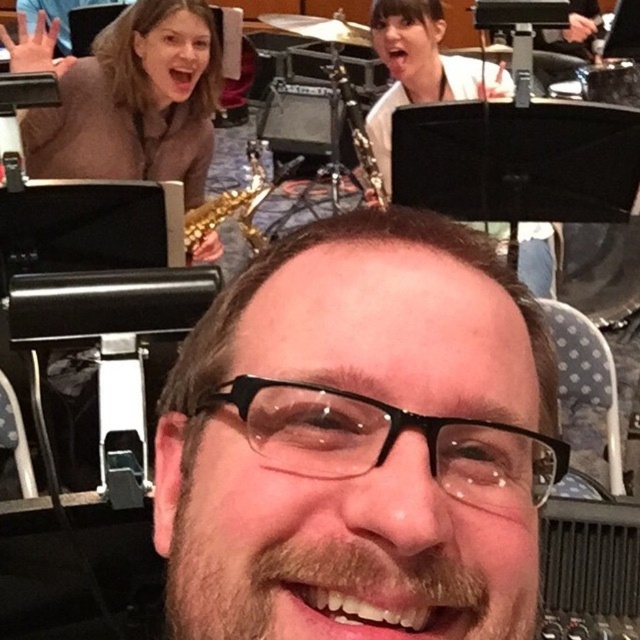
Between point (528, 436) and point (349, 97), which one is positioned in front?

Point (528, 436)

Is point (339, 320) less distant than point (362, 188)?

Yes, it is in front of point (362, 188).

What do you see at coordinates (356, 440) in the screenshot? The image size is (640, 640). I see `brown matte glasses at center` at bounding box center [356, 440].

You are a GUI agent. You are given a task and a screenshot of the screen. Output one action in this format:
    pyautogui.click(x=<x>, y=<y>)
    Task: Click on the brown matte glasses at center
    
    Given the screenshot: What is the action you would take?
    pyautogui.click(x=356, y=440)